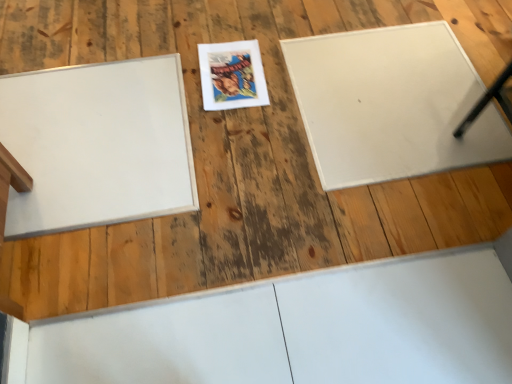
Where is `vacant space situated above matte paper comic book at center (from a real-world perspective)`? This screenshot has height=384, width=512. vacant space situated above matte paper comic book at center (from a real-world perspective) is located at coordinates (233, 73).